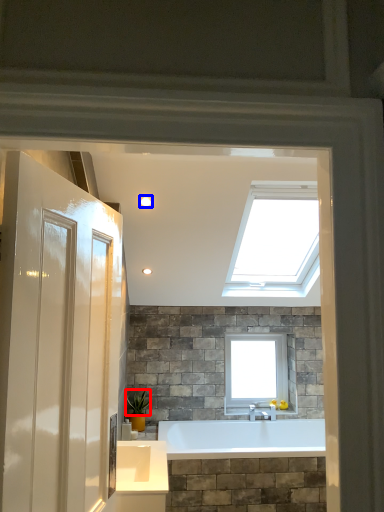
Question: Which object is further to the camera taking this photo, plant (highlighted by a red box) or lighting (highlighted by a blue box)?

Choices:
 (A) plant
 (B) lighting

Answer: (A)